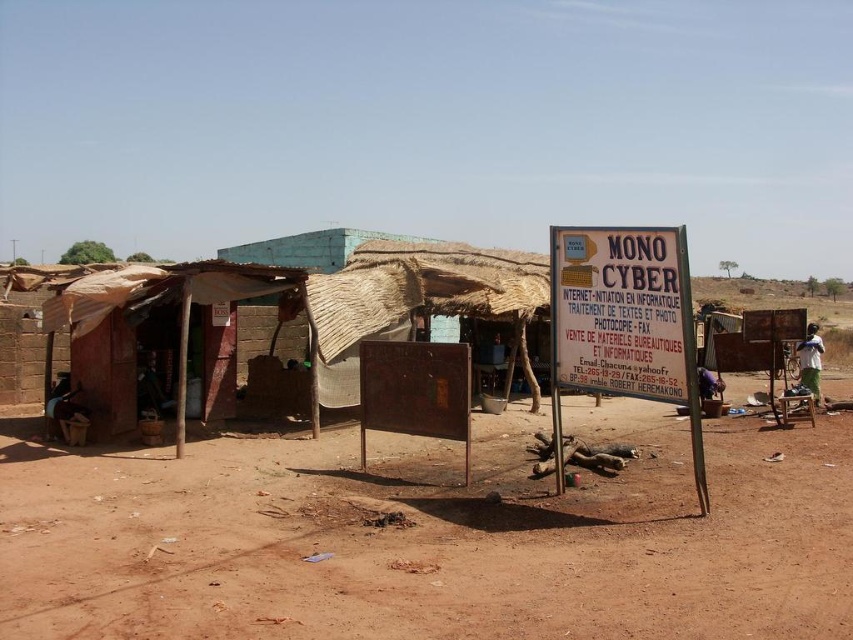
What do you see at coordinates (433, 538) in the screenshot? This screenshot has height=640, width=853. I see `brown dirt field at center` at bounding box center [433, 538].

Can you confirm if brown dirt field at center is positioned to the left of white paper sign at center?

Yes, brown dirt field at center is to the left of white paper sign at center.

Between point (160, 538) and point (695, 413), which one is positioned in front?

Point (160, 538) is in front.

Find the location of a particular element. The width and height of the screenshot is (853, 640). brown dirt field at center is located at coordinates (433, 538).

Does white paper sign at center have a lesser width compared to white fabric shirt at right?

In fact, white paper sign at center might be wider than white fabric shirt at right.

Who is more distant from viewer, (x=633, y=264) or (x=808, y=390)?

The point (x=808, y=390) is behind.

Is point (602, 314) less distant than point (809, 380)?

Yes, point (602, 314) is in front of point (809, 380).

Identify the location of white paper sign at center. (624, 323).

Between brown dirt field at center and white fabric shirt at right, which one has less height?

With less height is brown dirt field at center.

Is brown dirt field at center positioned behind white fabric shirt at right?

No, brown dirt field at center is in front of white fabric shirt at right.

Between point (230, 600) and point (817, 326), which one is positioned in front?

Positioned in front is point (230, 600).

The height and width of the screenshot is (640, 853). Find the location of `brown dirt field at center`. brown dirt field at center is located at coordinates (433, 538).